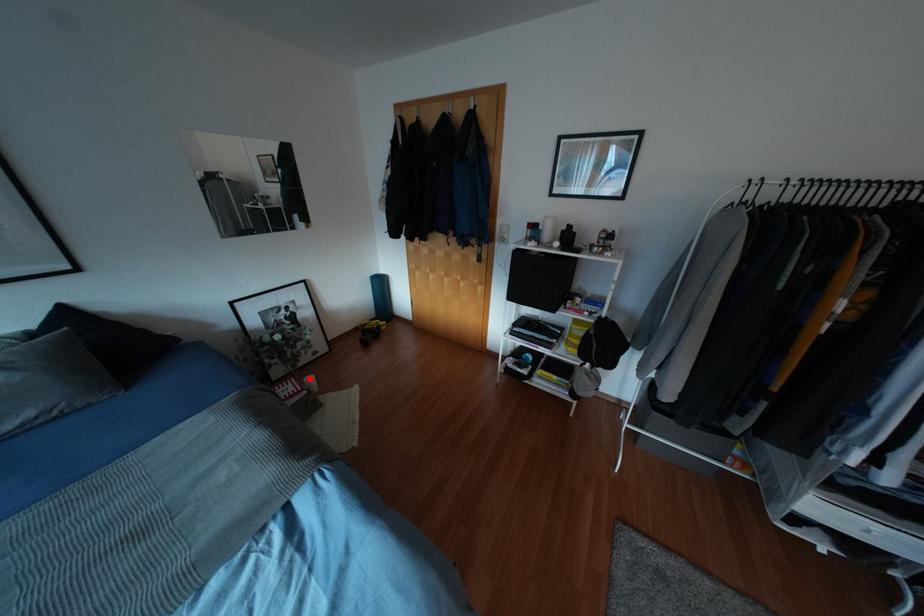
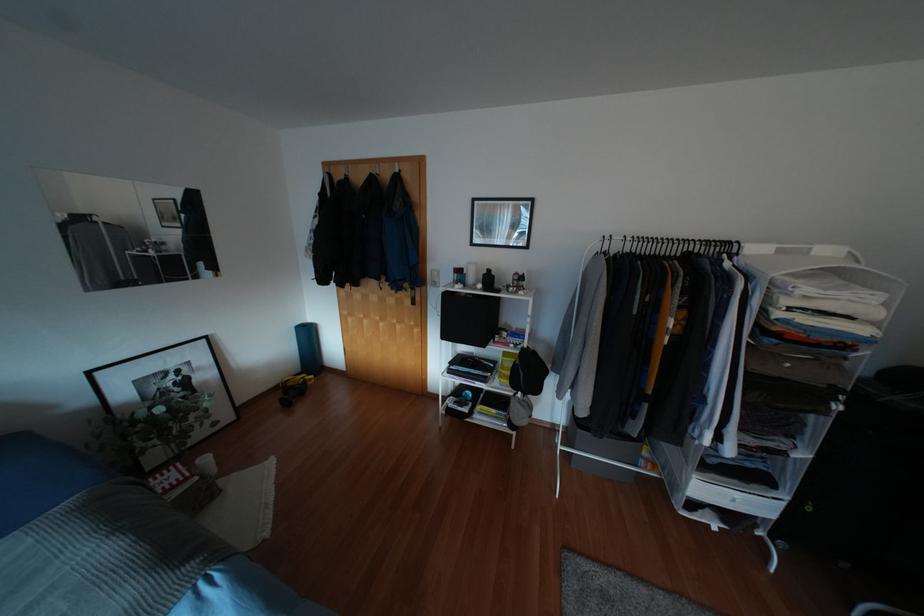
Question: I am providing you with two images of the same scene from different viewpoints. Image1 has a red point marked. In image2, the corresponding 3D location appears at what relative position? Reply with the corresponding letter.

Choices:
 (A) Closer
 (B) Farther

Answer: (B)